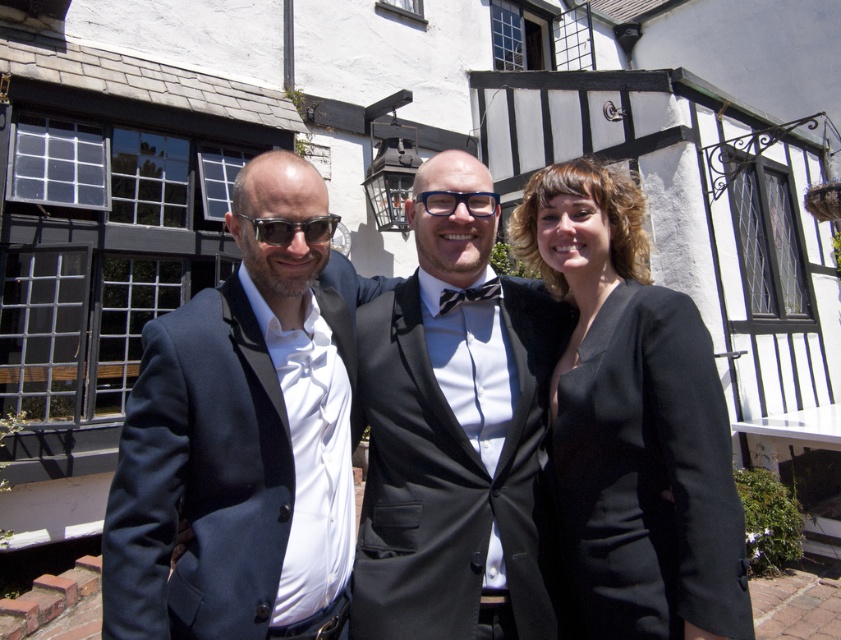
Question: Does black wool dress at center appear under matte black sunglasses at center?

Choices:
 (A) yes
 (B) no

Answer: (A)

Question: Which point appears farthest from the camera in this image?

Choices:
 (A) (504, 456)
 (B) (376, 588)
 (C) (236, 276)
 (D) (495, 208)

Answer: (D)

Question: Which object is the farthest from the black satin suit at center?

Choices:
 (A) blue plastic glasses at center
 (B) matte black suit at center

Answer: (A)

Question: Can you confirm if matte black sunglasses at center is smaller than blue plastic glasses at center?

Choices:
 (A) no
 (B) yes

Answer: (A)

Question: Estimate the real-world distances between objects in this image. Which object is closer to the navy wool suit at center?

Choices:
 (A) black satin suit at center
 (B) matte black sunglasses at center

Answer: (A)

Question: Is black wool dress at center positioned before matte black sunglasses at center?

Choices:
 (A) yes
 (B) no

Answer: (A)